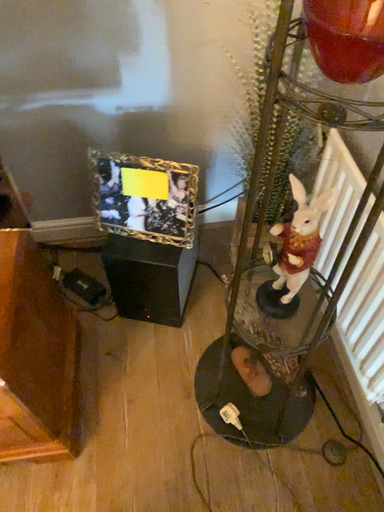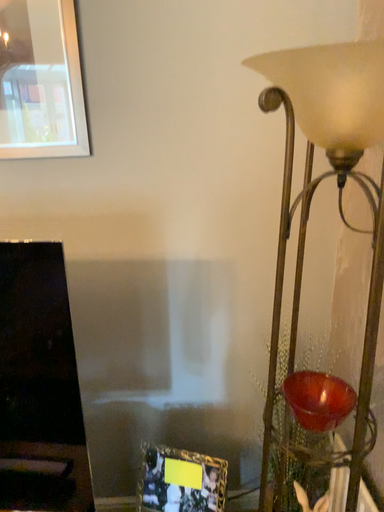
Question: Which way did the camera rotate in the video?

Choices:
 (A) rotated downward
 (B) rotated upward

Answer: (B)